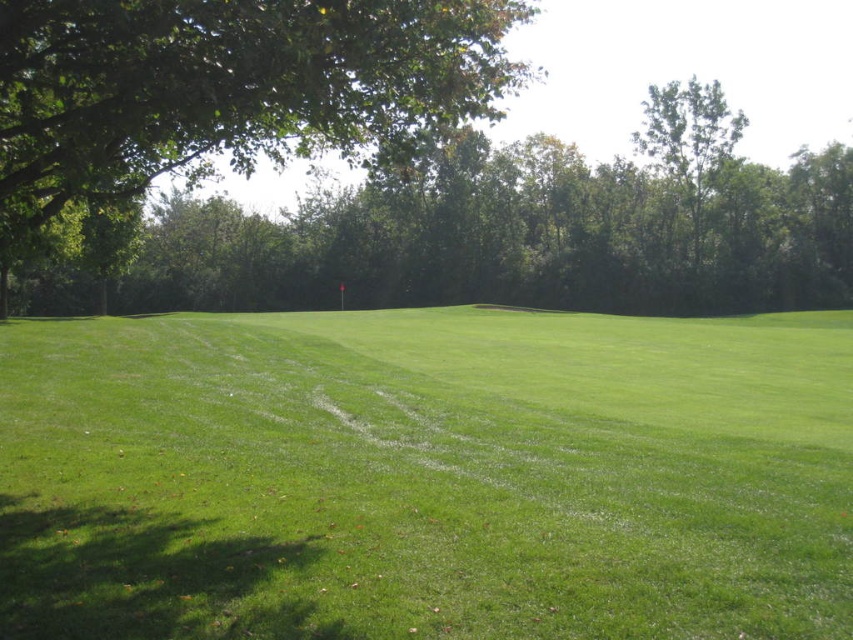
Can you confirm if green grass at center is bigger than green leafy tree at upper right?

No, green grass at center is not bigger than green leafy tree at upper right.

Which of these two, green grass at center or green leafy tree at upper right, stands shorter?

With less height is green grass at center.

Which is behind, point (57, 493) or point (657, 96)?

The point (657, 96) is more distant.

Locate an element on the screen. green grass at center is located at coordinates (426, 476).

Does green grass at center lie in front of green leafy tree at upper left?

Yes, it is in front of green leafy tree at upper left.

Can you confirm if green grass at center is positioned below green leafy tree at upper left?

Yes, green grass at center is below green leafy tree at upper left.

Is point (328, 624) closer to viewer compared to point (79, 106)?

That is True.

At what (x,y) coordinates should I click in order to perform the action: click on green grass at center. Please return your answer as a coordinate pair (x, y). This screenshot has width=853, height=640. Looking at the image, I should click on (426, 476).

Can you confirm if green leafy tree at upper left is positioned to the left of green leafy tree at upper right?

Correct, you'll find green leafy tree at upper left to the left of green leafy tree at upper right.

Where is `green leafy tree at upper left`? The width and height of the screenshot is (853, 640). green leafy tree at upper left is located at coordinates (223, 88).